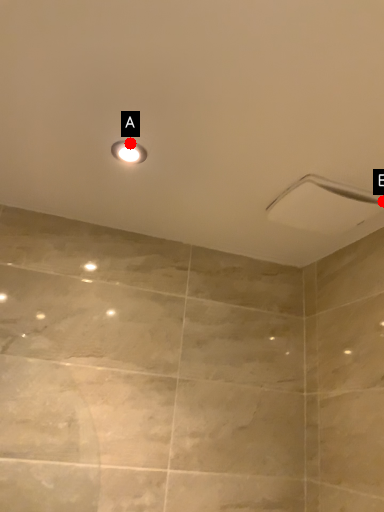
Question: Two points are circled on the image, labeled by A and B beside each circle. Which point is closer to the camera?

Choices:
 (A) A is closer
 (B) B is closer

Answer: (A)